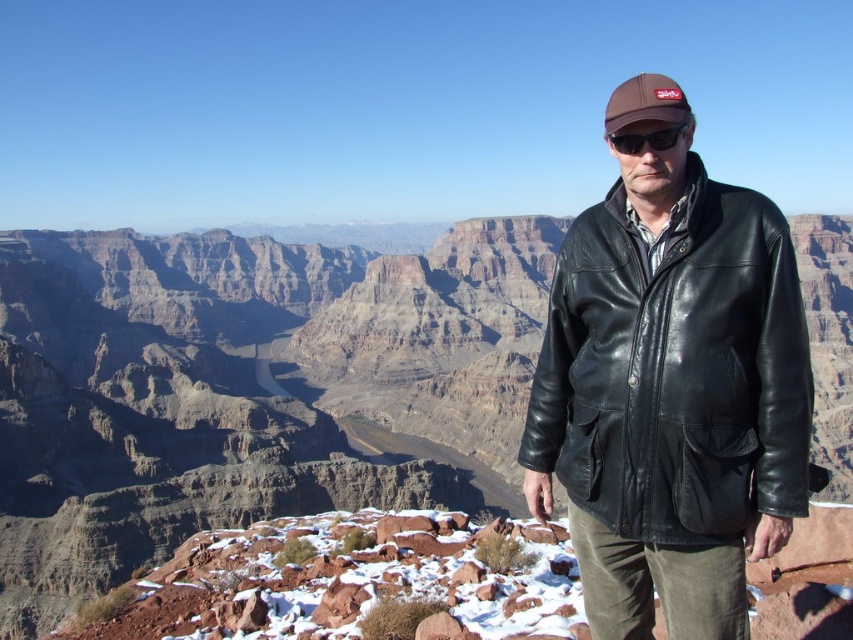
Is rugged rock canyon at center to the right of black matte sunglasses at center from the viewer's perspective?

In fact, rugged rock canyon at center is to the left of black matte sunglasses at center.

Which is in front, point (242, 506) or point (634, 141)?

Point (634, 141)

Where is `rugged rock canyon at center`? This screenshot has width=853, height=640. rugged rock canyon at center is located at coordinates (248, 388).

Between point (532, 378) and point (683, 124), which one is positioned in front?

Point (683, 124)

Is black leather jacket at right positioned behind black matte sunglasses at center?

That is False.

Between point (756, 353) and point (633, 141), which one is positioned in front?

Positioned in front is point (756, 353).

Find the location of a particular element. This screenshot has width=853, height=640. black leather jacket at right is located at coordinates tap(675, 369).

Measure the distance between point (625, 93) and camera.

Point (625, 93) is 26.76 meters away from camera.

Can you confirm if brown leather baseball hat at upper center is taller than black matte sunglasses at center?

Indeed, brown leather baseball hat at upper center has a greater height compared to black matte sunglasses at center.

Which is in front, point (663, 120) or point (657, 150)?

Point (663, 120)

This screenshot has width=853, height=640. Find the location of `brown leather baseball hat at upper center`. brown leather baseball hat at upper center is located at coordinates (645, 102).